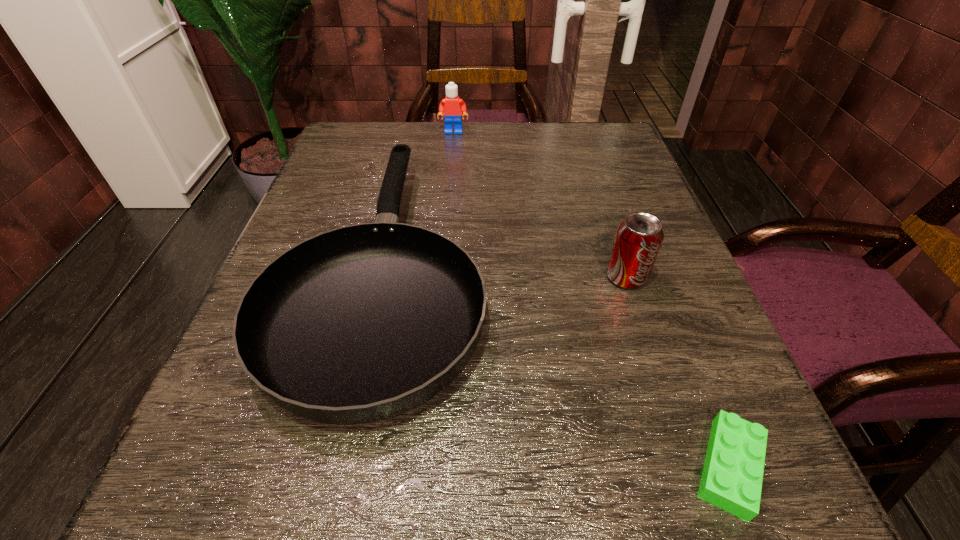
Locate an element on the screen. Image resolution: width=960 pixels, height=540 pixels. free space located at the end of the handle of the frying pan is located at coordinates (414, 135).

At what (x,y) coordinates should I click in order to perform the action: click on free space located on the left of the shorter Lego. Please return your answer as a coordinate pair (x, y). Looking at the image, I should click on (355, 467).

Locate an element on the screen. The image size is (960, 540). Lego present at the far edge is located at coordinates (452, 106).

Where is `frying pan that is at the far edge`? Image resolution: width=960 pixels, height=540 pixels. frying pan that is at the far edge is located at coordinates (365, 322).

In order to click on object at the near edge in this screenshot , I will do `click(732, 475)`.

I want to click on object at the left edge, so click(365, 322).

Where is `soda can at the right edge`? The width and height of the screenshot is (960, 540). soda can at the right edge is located at coordinates (638, 239).

Locate an element on the screen. This screenshot has width=960, height=540. Lego situated at the right edge is located at coordinates (732, 475).

Find the location of a particular element. The image size is (960, 540). object that is positioned at the far left corner is located at coordinates (365, 322).

At what (x,y) coordinates should I click in order to perform the action: click on object located at the near right corner. Please return your answer as a coordinate pair (x, y). The width and height of the screenshot is (960, 540). Looking at the image, I should click on (732, 475).